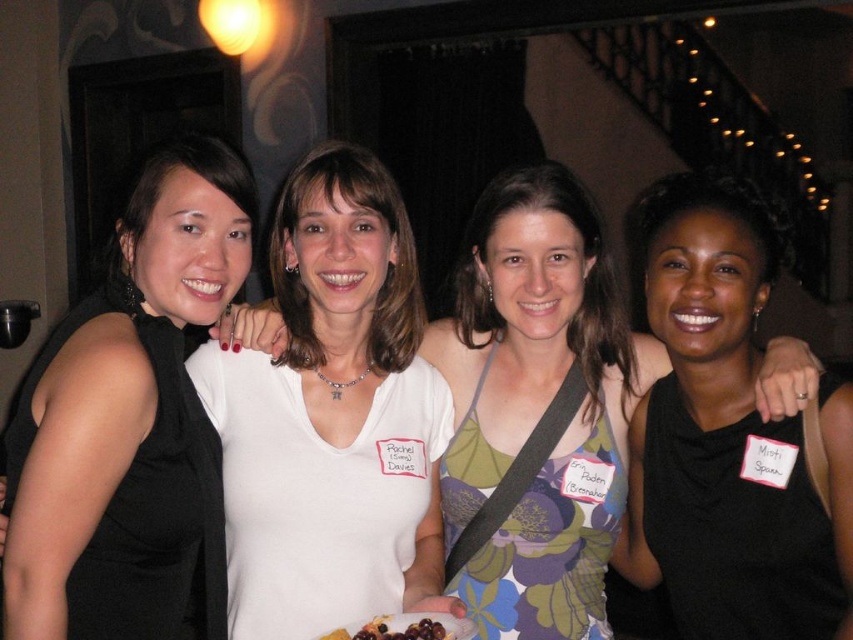
Is point (277, 403) in front of point (596, 240)?

Yes, point (277, 403) is in front of point (596, 240).

Can you confirm if white matte shirt at center is positioned to the left of white matte tank top at center?

Correct, you'll find white matte shirt at center to the left of white matte tank top at center.

Locate an element on the screen. Image resolution: width=853 pixels, height=640 pixels. white matte shirt at center is located at coordinates (331, 417).

The image size is (853, 640). What do you see at coordinates (537, 406) in the screenshot?
I see `white matte tank top at center` at bounding box center [537, 406].

Can you confirm if white matte tank top at center is positioned to the left of black satin dress at center?

Indeed, white matte tank top at center is positioned on the left side of black satin dress at center.

Between point (569, 244) and point (816, 506), which one is positioned behind?

Positioned behind is point (569, 244).

Where is `white matte tank top at center`? white matte tank top at center is located at coordinates (537, 406).

Is black satin dress at center to the left of smooth chocolate cake with berries at center from the viewer's perspective?

Incorrect, black satin dress at center is not on the left side of smooth chocolate cake with berries at center.

Is point (744, 568) less distant than point (392, 620)?

Yes, point (744, 568) is in front of point (392, 620).

Between point (780, 616) and point (410, 637), which one is positioned in front?

Point (410, 637)

Locate an element on the screen. black satin dress at center is located at coordinates (727, 436).